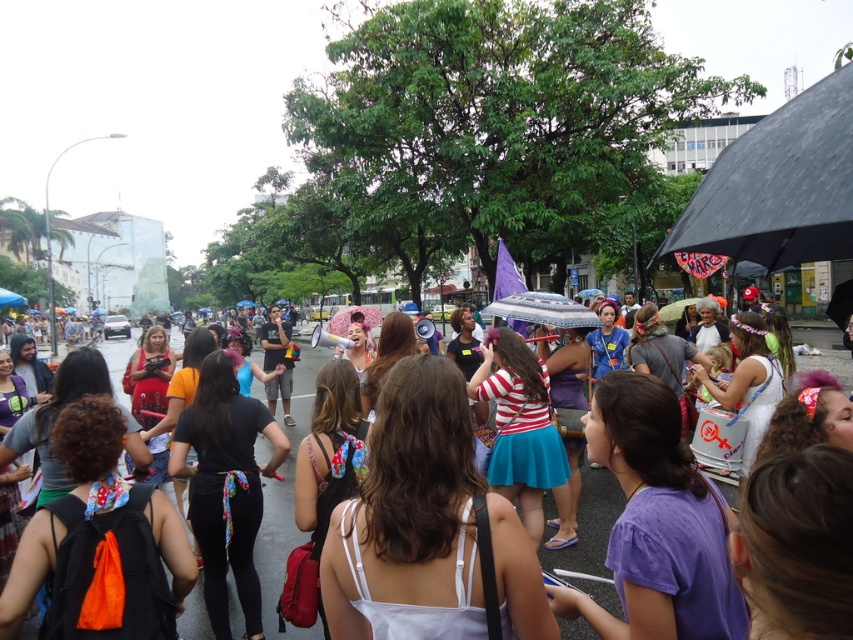
Question: Can you confirm if white fabric dress at center is bigger than white cotton dress at center?

Choices:
 (A) no
 (B) yes

Answer: (A)

Question: Is white fabric dress at center smaller than white cotton dress at center?

Choices:
 (A) no
 (B) yes

Answer: (B)

Question: Is white fabric dress at center smaller than white cotton dress at center?

Choices:
 (A) no
 (B) yes

Answer: (B)

Question: Among these objects, which one is farthest from the camera?

Choices:
 (A) white fabric dress at center
 (B) white cotton dress at center

Answer: (B)